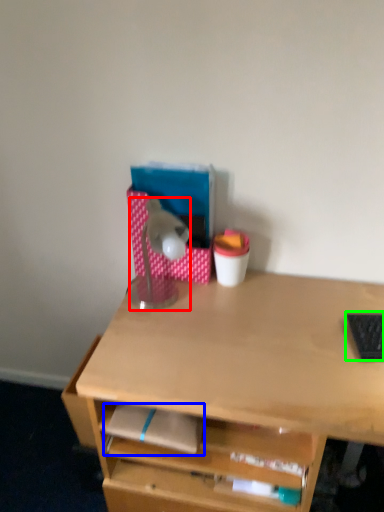
Question: Which object is positioned farthest from lamp (highlighted by a red box)? Select from notepad (highlighted by a blue box) and laptop keyboard (highlighted by a green box).

Choices:
 (A) notepad
 (B) laptop keyboard

Answer: (B)